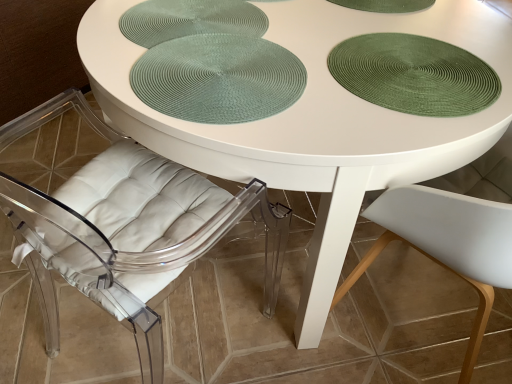
The width and height of the screenshot is (512, 384). I want to click on vacant space underneath green textured placemat at upper right, positioned as the 2th glass plate in left-to-right order (from a real-world perspective), so click(388, 61).